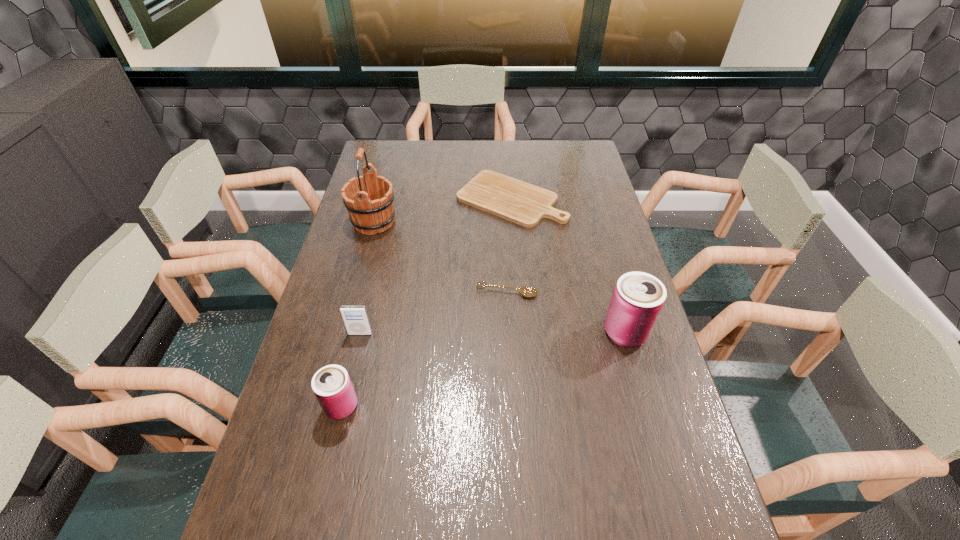
The image size is (960, 540). I want to click on vacant space at the far edge of the desktop, so click(479, 153).

The width and height of the screenshot is (960, 540). In the image, there is a desktop. Find the location of `vacant space at the near edge`. vacant space at the near edge is located at coordinates (440, 511).

In the image, there is a desktop. In order to click on free space at the left edge in this screenshot , I will do click(284, 414).

Where is `vacant space at the right edge of the desktop`? This screenshot has height=540, width=960. vacant space at the right edge of the desktop is located at coordinates (584, 251).

The width and height of the screenshot is (960, 540). Find the location of `vacant space at the far left corner`. vacant space at the far left corner is located at coordinates (406, 151).

Where is `vacant space at the far right corner of the desktop`? vacant space at the far right corner of the desktop is located at coordinates (589, 159).

The image size is (960, 540). Identify the location of free space between the rightmost object and the iPod. (492, 333).

Identify the location of free space that is in between the iPod and the nearer can. This screenshot has width=960, height=540. (351, 370).

You are a GUI agent. You are given a task and a screenshot of the screen. Output one action in this format:
    pyautogui.click(x=<x>, y=<y>)
    Task: Click on the free point between the second tallest object and the iPod
    The width and height of the screenshot is (960, 540).
    Given the screenshot: What is the action you would take?
    pyautogui.click(x=492, y=333)

Where is `vacant point located between the farther can and the tallest object`? vacant point located between the farther can and the tallest object is located at coordinates (499, 277).